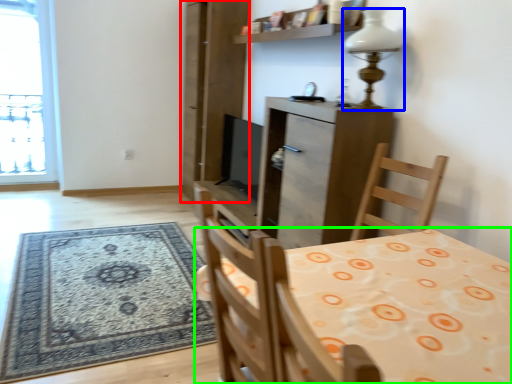
Question: Based on their relative distances, which object is nearer to screen door (highlighted by a red box)? Choose from lamp (highlighted by a blue box) and table (highlighted by a green box).

Choices:
 (A) lamp
 (B) table

Answer: (A)